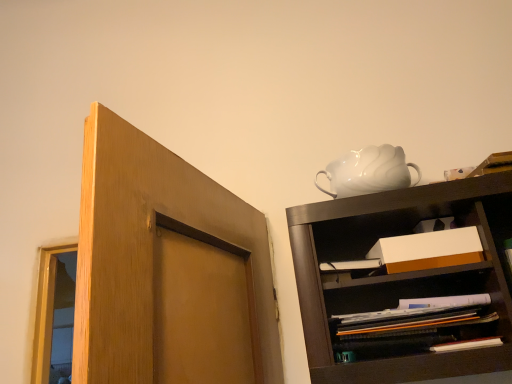
Question: Does point (480, 279) appear closer or farther from the camera than point (397, 243)?

Choices:
 (A) farther
 (B) closer

Answer: (A)

Question: Is matte brown shelf at lower right in front of or behind white cardboard box at center in the image?

Choices:
 (A) front
 (B) behind

Answer: (A)

Question: Which is farther from the white glossy teapot at upper right?

Choices:
 (A) white cardboard box at center
 (B) matte brown shelf at lower right

Answer: (B)

Question: Which is nearer to the white cardboard box at center?

Choices:
 (A) matte brown shelf at lower right
 (B) white glossy teapot at upper right

Answer: (A)